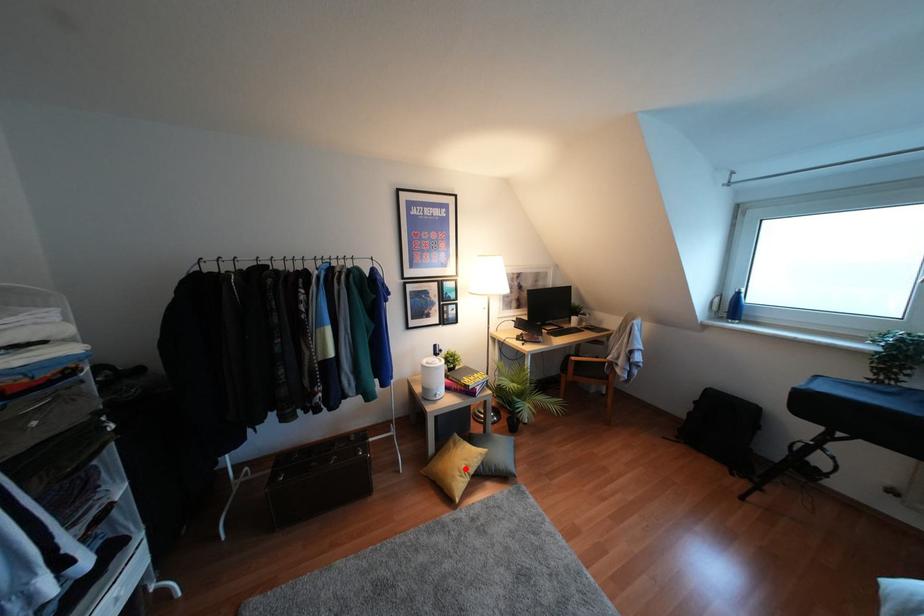
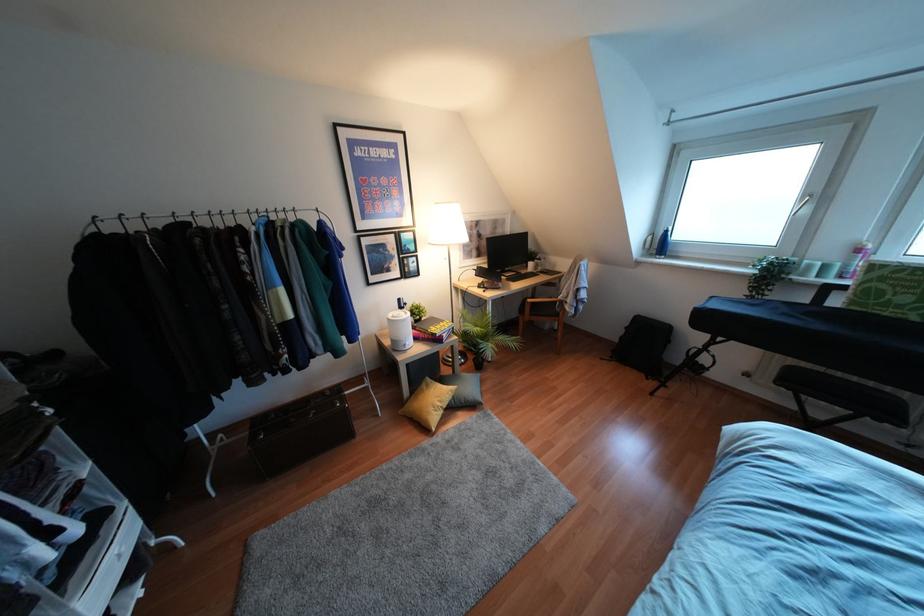
Question: I am providing you with two images of the same scene from different viewpoints. A red point is shown in image1. For the corresponding object point in image2, is it positioned nearer or farther from the camera?

Choices:
 (A) Nearer
 (B) Farther

Answer: (B)